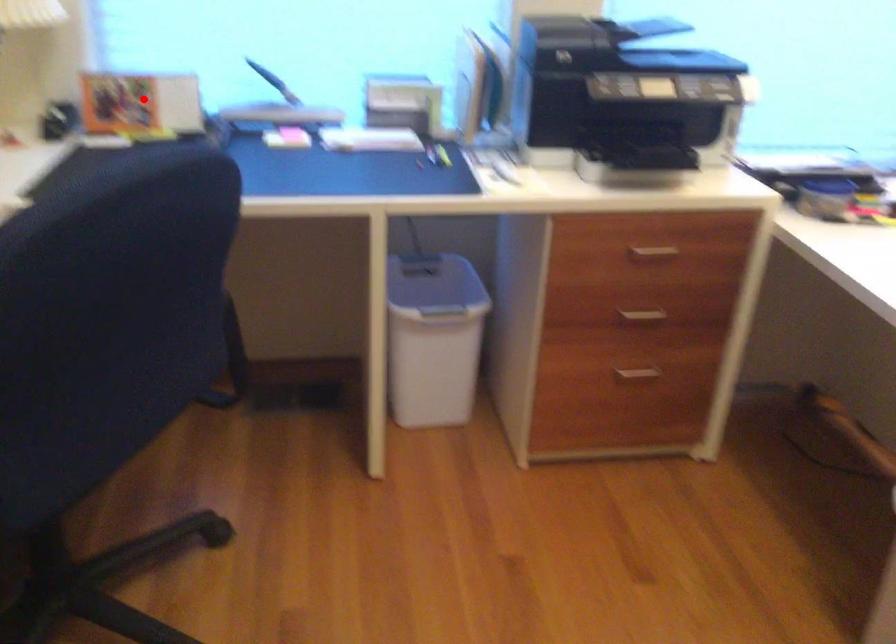
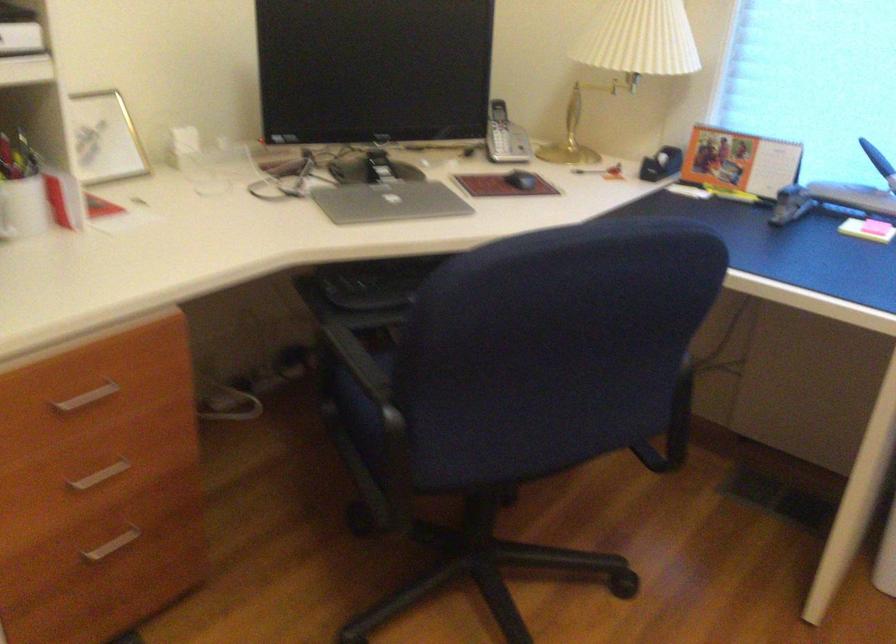
Where in the second image is the point corresponding to the highlighted location from the first image?

(739, 162)